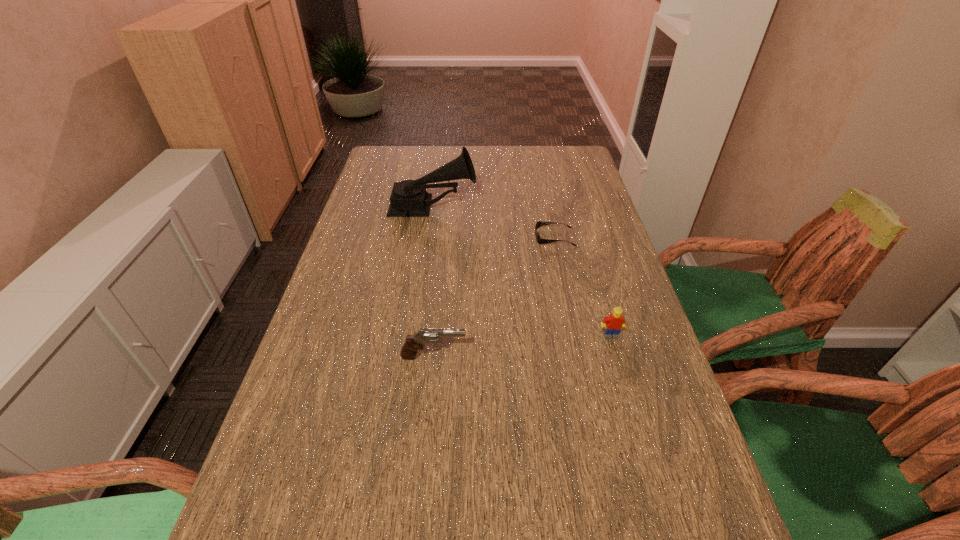
The image size is (960, 540). Find the location of `the tallest object`. the tallest object is located at coordinates (409, 198).

Find the location of a particular element. This screenshot has width=960, height=540. the farthest object is located at coordinates (409, 198).

Where is `pistol`? This screenshot has height=540, width=960. pistol is located at coordinates (415, 342).

Where is `Lego`? The image size is (960, 540). Lego is located at coordinates (615, 322).

Locate an element on the screen. the third nearest object is located at coordinates (540, 241).

Where is `sunglasses`? sunglasses is located at coordinates (540, 241).

Identify the location of blank area located from the horn of the phonograph_record. (520, 207).

Identify the location of free space located 0.380m at the barrel of the nearest object. (640, 357).

Where is `vacant region located 0.170m on the front-facing side of the third farthest object`? This screenshot has width=960, height=540. vacant region located 0.170m on the front-facing side of the third farthest object is located at coordinates (631, 405).

This screenshot has width=960, height=540. I want to click on vacant space located 0.270m on the front-facing side of the second farthest object, so click(x=443, y=237).